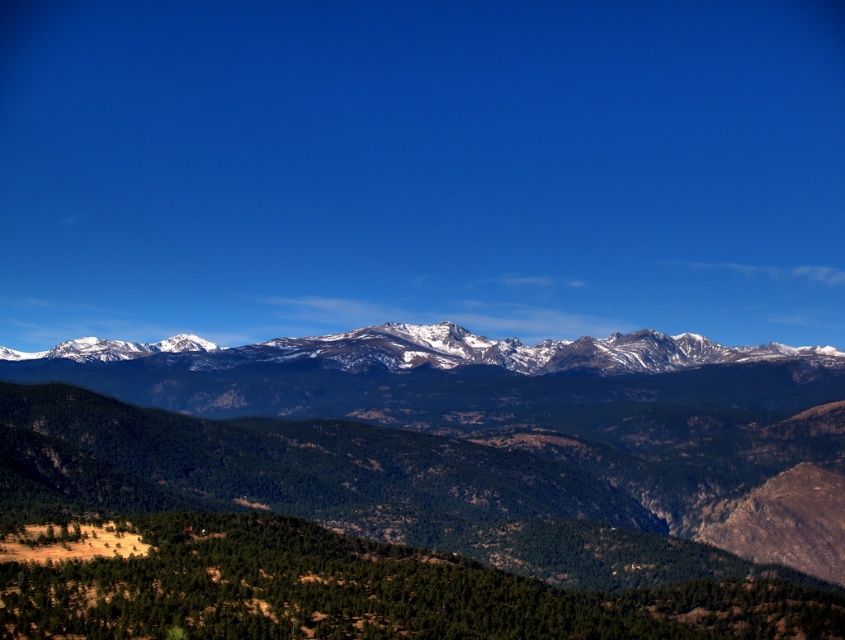
You are a hiker planning to take a photo of both the green textured hillside at lower center and the snowy rocky mountain range at center. Which object should you position to your left to capture both in the frame?

To capture both the green textured hillside at lower center and the snowy rocky mountain range at center in the frame, position the snowy rocky mountain range at center to your left since the green textured hillside at lower center is located to the right of it.